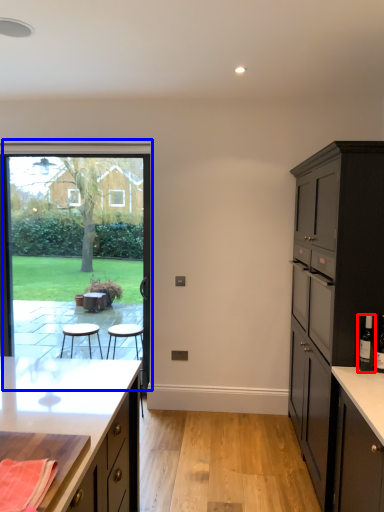
Question: Among these objects, which one is nearest to the camera, bottle (highlighted by a red box) or window (highlighted by a blue box)?

Choices:
 (A) bottle
 (B) window

Answer: (A)